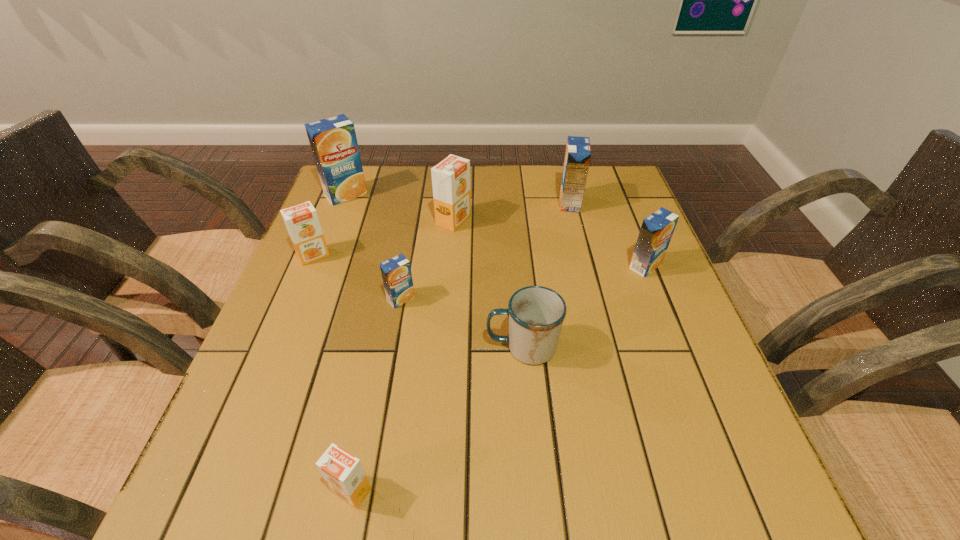
In order to click on the second nearest object in this screenshot , I will do `click(536, 313)`.

Identify the location of mug. This screenshot has width=960, height=540. (536, 313).

This screenshot has width=960, height=540. What are the coordinates of `the smallest blue orange_juice` in the screenshot? It's located at (396, 273).

At what (x,y) coordinates should I click in order to perform the action: click on the third blue orange_juice from right to left. Please return your answer as a coordinate pair (x, y). Looking at the image, I should click on (396, 273).

Where is `the second orange orange juice from left to right`? the second orange orange juice from left to right is located at coordinates (344, 474).

Identify the location of the nearest object. Image resolution: width=960 pixels, height=540 pixels. (344, 474).

Where is `vacant space situated on the right of the leftmost blue orange_juice`? The image size is (960, 540). vacant space situated on the right of the leftmost blue orange_juice is located at coordinates (505, 194).

Find the location of a particular element. blank space located on the left of the third smallest blue orange_juice is located at coordinates (427, 203).

Where is `free space located 0.090m on the back of the third orange juice from right to left`? free space located 0.090m on the back of the third orange juice from right to left is located at coordinates (456, 191).

Locate an element on the screen. The width and height of the screenshot is (960, 540). vacant space located on the front of the second smallest orange orange juice is located at coordinates (294, 302).